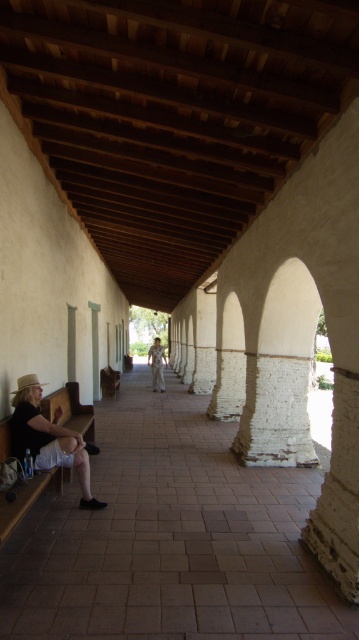
You are standing at the entrance of the walkway and want to locate the matte black shirt at lower left. According to the coordinates provided, where should you look relative to the walkway?

The matte black shirt at lower left is located at point (48, 438), which means it is positioned approximately two thirds of the way to the right and slightly downward from the top left corner of the walkway.

You are a photographer trying to capture both the matte black shirt at lower left and the light brown wood statue at center in a single frame. Which object should you focus on first to ensure both are in the frame?

You should focus on the light brown wood statue at center first since it is taller than the matte black shirt at lower left, ensuring it fits within the frame.